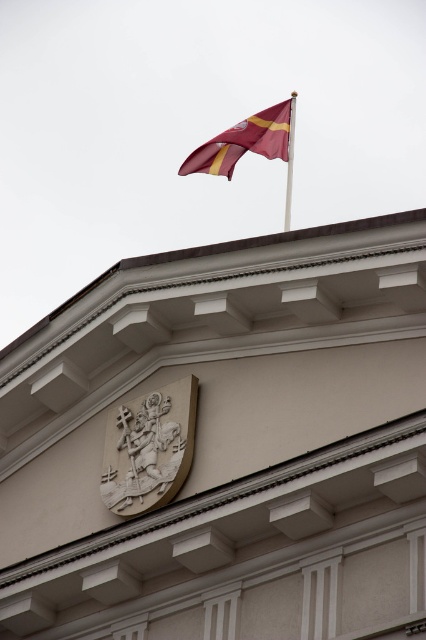
Measure the distance between point (288, 99) and camera.

A distance of 157.47 meters exists between point (288, 99) and camera.

Is maroon fabric flag at upper center further to camera compared to metallic flag pole at upper center?

No, it is not.

Which is in front, point (284, 124) or point (290, 152)?

Point (290, 152) is more forward.

Find the location of a particular element. The width and height of the screenshot is (426, 640). maroon fabric flag at upper center is located at coordinates (244, 141).